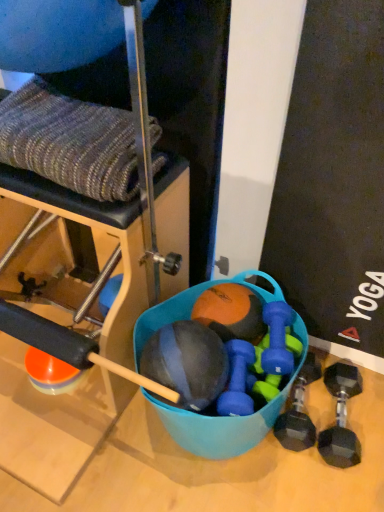
You are a GUI agent. You are given a task and a screenshot of the screen. Output one action in this format:
    pyautogui.click(x=<x>, y=<y>)
    Task: Click on the blue rubber dumbbell at center, marked as the 3th dumbbell in a right-to-left arrangement
    The width and height of the screenshot is (384, 512).
    Given the screenshot: What is the action you would take?
    coord(277,339)

I want to click on knitted fabric at upper left, so click(x=145, y=155).

I want to click on matte black dumbbell at lower right, which is the third dumbbell in left-to-right order, so click(x=298, y=411).

Measure the distance between point (x=233, y=369) and camera.

The depth of point (x=233, y=369) is 3.29 feet.

Locate an element on the screen. black rubber dumbbell at lower right, the 1th dumbbell positioned from the right is located at coordinates (341, 417).

This screenshot has width=384, height=512. Identify the location of bowl on the right of the blue rubber dumbbell at center, the first dumbbell from the left. (226, 419).

Is blue rubber dumbbell at center, the fourth dumbbell positioned from the right, oriented towards blue rubber bucket at center?

Yes, blue rubber dumbbell at center, the fourth dumbbell positioned from the right, is aimed at blue rubber bucket at center.

From the image's perspective, would you say blue rubber dumbbell at center, the first dumbbell from the left, is shown under blue rubber bucket at center?

No, from the image's perspective, blue rubber dumbbell at center, the first dumbbell from the left, is not beneath blue rubber bucket at center.

From the picture: Is blue rubber dumbbell at center, the first dumbbell from the left, inside or outside of blue rubber bucket at center?

The correct answer is: inside.

From a real-world perspective, which is physically above, matte black medicine ball at center, placed as the 2th ball when sorted from back to front, or blue rubber dumbbell at center, the fourth dumbbell positioned from the right?

In real-world perspective, matte black medicine ball at center, placed as the 2th ball when sorted from back to front, is above.

Considering the relative sizes of matte black medicine ball at center, placed as the 2th ball when sorted from back to front, and blue rubber dumbbell at center, the first dumbbell from the left, in the image provided, is matte black medicine ball at center, placed as the 2th ball when sorted from back to front, bigger than blue rubber dumbbell at center, the first dumbbell from the left,?

Indeed, matte black medicine ball at center, placed as the 2th ball when sorted from back to front, has a larger size compared to blue rubber dumbbell at center, the first dumbbell from the left.

Which is less distant, (197,343) or (238,377)?

The point (197,343) is closer to the camera.

The height and width of the screenshot is (512, 384). In order to click on the 2nd ball to the left of the blue rubber bucket at center, starting your count from the anchor in this screenshot , I will do `click(187, 362)`.

Does matte black medicine ball at center, the first ball positioned from the front, have a greater width compared to blue rubber bucket at center?

No.

From the image's perspective, who appears lower, matte black medicine ball at center, placed as the 2th ball when sorted from back to front, or blue rubber bucket at center?

blue rubber bucket at center.

Which is in front, matte black medicine ball at center, the first ball positioned from the front, or blue rubber bucket at center?

matte black medicine ball at center, the first ball positioned from the front, is closer to the camera.

Based on their positions, is blue rubber dumbbell at center, the fourth dumbbell positioned from the right, located to the left or right of blue rubber dumbbell at center, marked as the 3th dumbbell in a right-to-left arrangement?

In the image, blue rubber dumbbell at center, the fourth dumbbell positioned from the right, appears on the left side of blue rubber dumbbell at center, marked as the 3th dumbbell in a right-to-left arrangement.

In the image, is blue rubber dumbbell at center, the first dumbbell from the left, positioned in front of or behind blue rubber dumbbell at center, marked as the 3th dumbbell in a right-to-left arrangement?

In the image, blue rubber dumbbell at center, the first dumbbell from the left, appears in front of blue rubber dumbbell at center, marked as the 3th dumbbell in a right-to-left arrangement.

Would you say blue rubber dumbbell at center, the first dumbbell from the left, is inside or outside blue rubber dumbbell at center, which ranks as the second dumbbell in left-to-right order?

blue rubber dumbbell at center, the first dumbbell from the left, lies outside blue rubber dumbbell at center, which ranks as the second dumbbell in left-to-right order.

Identify the location of dumbbell that is the 1st object located behind the blue rubber dumbbell at center, the first dumbbell from the left. (277, 339).

Is black rubber dumbbell at lower right, positioned as the 4th dumbbell in left-to-right order, positioned far away from orange matte ball at center, which is the 2th ball from front to back?

No, black rubber dumbbell at lower right, positioned as the 4th dumbbell in left-to-right order, is not far from orange matte ball at center, which is the 2th ball from front to back.

From the image's perspective, is black rubber dumbbell at lower right, positioned as the 4th dumbbell in left-to-right order, below orange matte ball at center, which is the first ball in back-to-front order?

Yes, from the image's perspective, black rubber dumbbell at lower right, positioned as the 4th dumbbell in left-to-right order, is below orange matte ball at center, which is the first ball in back-to-front order.

Considering the relative sizes of black rubber dumbbell at lower right, positioned as the 4th dumbbell in left-to-right order, and orange matte ball at center, which is the 2th ball from front to back, in the image provided, is black rubber dumbbell at lower right, positioned as the 4th dumbbell in left-to-right order, smaller than orange matte ball at center, which is the 2th ball from front to back,?

Actually, black rubber dumbbell at lower right, positioned as the 4th dumbbell in left-to-right order, might be larger than orange matte ball at center, which is the 2th ball from front to back.

From a real-world perspective, is black rubber dumbbell at lower right, the 1th dumbbell positioned from the right, physically below orange matte ball at center, which is the 2th ball from front to back?

Yes.

From a real-world perspective, which is physically below, knitted fabric at upper left or blue rubber dumbbell at center, which ranks as the second dumbbell in left-to-right order?

In real-world perspective, blue rubber dumbbell at center, which ranks as the second dumbbell in left-to-right order, is lower.

Considering their positions, is knitted fabric at upper left located in front of or behind blue rubber dumbbell at center, which ranks as the second dumbbell in left-to-right order?

In the image, knitted fabric at upper left appears in front of blue rubber dumbbell at center, which ranks as the second dumbbell in left-to-right order.

Who is taller, knitted fabric at upper left or blue rubber dumbbell at center, marked as the 3th dumbbell in a right-to-left arrangement?

knitted fabric at upper left.

Would you say blue rubber dumbbell at center, marked as the 3th dumbbell in a right-to-left arrangement, is inside or outside matte black dumbbell at lower right, which is the third dumbbell in left-to-right order?

blue rubber dumbbell at center, marked as the 3th dumbbell in a right-to-left arrangement, is spatially situated outside matte black dumbbell at lower right, which is the third dumbbell in left-to-right order.

Is blue rubber dumbbell at center, marked as the 3th dumbbell in a right-to-left arrangement, not close to matte black dumbbell at lower right, which is the third dumbbell in left-to-right order?

No, blue rubber dumbbell at center, marked as the 3th dumbbell in a right-to-left arrangement, is not far away from matte black dumbbell at lower right, which is the third dumbbell in left-to-right order.

Is blue rubber dumbbell at center, which ranks as the second dumbbell in left-to-right order, taller or shorter than matte black dumbbell at lower right, which is counted as the 2th dumbbell, starting from the right?

In the image, blue rubber dumbbell at center, which ranks as the second dumbbell in left-to-right order, appears to be shorter than matte black dumbbell at lower right, which is counted as the 2th dumbbell, starting from the right.

You are a GUI agent. You are given a task and a screenshot of the screen. Output one action in this format:
    pyautogui.click(x=<x>, y=<y>)
    Task: Click on the dumbbell that is the 2nd one when counting upward from the matte black dumbbell at lower right, which is the third dumbbell in left-to-right order (from the image's perspective)
    
    Given the screenshot: What is the action you would take?
    pyautogui.click(x=277, y=339)

Identify the location of bowl below the blue rubber dumbbell at center, the fourth dumbbell positioned from the right (from the image's perspective). (226, 419).

I want to click on dumbbell that is the 1st one when counting rightward from the matte black medicine ball at center, placed as the 2th ball when sorted from back to front, so click(237, 380).

Considering their positions, is matte black medicine ball at center, the first ball positioned from the front, positioned closer to blue rubber bucket at center than orange matte ball at center, which is the 2th ball from front to back?

orange matte ball at center, which is the 2th ball from front to back, is positioned closer to the anchor blue rubber bucket at center.

Based on their spatial positions, is matte black medicine ball at center, the first ball positioned from the front, or black rubber dumbbell at lower right, positioned as the 4th dumbbell in left-to-right order, further from orange matte ball at center, which is the 2th ball from front to back?

black rubber dumbbell at lower right, positioned as the 4th dumbbell in left-to-right order, is further to orange matte ball at center, which is the 2th ball from front to back.

Estimate the real-world distances between objects in this image. Which object is further from blue rubber bucket at center, blue rubber dumbbell at center, which ranks as the second dumbbell in left-to-right order, or black rubber dumbbell at lower right, positioned as the 4th dumbbell in left-to-right order?

black rubber dumbbell at lower right, positioned as the 4th dumbbell in left-to-right order, is further to blue rubber bucket at center.

Estimate the real-world distances between objects in this image. Which object is closer to blue rubber dumbbell at center, the fourth dumbbell positioned from the right, blue rubber dumbbell at center, marked as the 3th dumbbell in a right-to-left arrangement, or knitted fabric at upper left?

blue rubber dumbbell at center, marked as the 3th dumbbell in a right-to-left arrangement, lies closer to blue rubber dumbbell at center, the fourth dumbbell positioned from the right, than the other object.

When comparing their distances from blue rubber dumbbell at center, marked as the 3th dumbbell in a right-to-left arrangement, does knitted fabric at upper left or blue rubber bucket at center seem closer?

blue rubber bucket at center.

Estimate the real-world distances between objects in this image. Which object is closer to blue rubber dumbbell at center, marked as the 3th dumbbell in a right-to-left arrangement, black rubber dumbbell at lower right, positioned as the 4th dumbbell in left-to-right order, or blue rubber dumbbell at center, the first dumbbell from the left?

blue rubber dumbbell at center, the first dumbbell from the left, is positioned closer to the anchor blue rubber dumbbell at center, marked as the 3th dumbbell in a right-to-left arrangement.

Based on their spatial positions, is orange matte ball at center, which is the first ball in back-to-front order, or blue rubber dumbbell at center, marked as the 3th dumbbell in a right-to-left arrangement, further from black rubber dumbbell at lower right, the 1th dumbbell positioned from the right?

Based on the image, orange matte ball at center, which is the first ball in back-to-front order, appears to be further to black rubber dumbbell at lower right, the 1th dumbbell positioned from the right.

Estimate the real-world distances between objects in this image. Which object is further from matte black medicine ball at center, placed as the 2th ball when sorted from back to front, blue rubber dumbbell at center, marked as the 3th dumbbell in a right-to-left arrangement, or black rubber dumbbell at lower right, positioned as the 4th dumbbell in left-to-right order?

Among the two, black rubber dumbbell at lower right, positioned as the 4th dumbbell in left-to-right order, is located further to matte black medicine ball at center, placed as the 2th ball when sorted from back to front.

The height and width of the screenshot is (512, 384). Identify the location of bowl between matte black medicine ball at center, placed as the 2th ball when sorted from back to front, and matte black dumbbell at lower right, which is counted as the 2th dumbbell, starting from the right, in the front-back direction. (226, 419).

The height and width of the screenshot is (512, 384). I want to click on ball located between matte black medicine ball at center, placed as the 2th ball when sorted from back to front, and matte black dumbbell at lower right, which is counted as the 2th dumbbell, starting from the right, in the left-right direction, so click(x=231, y=312).

Locate an element on the screen. The width and height of the screenshot is (384, 512). bowl situated between matte black medicine ball at center, the first ball positioned from the front, and black rubber dumbbell at lower right, positioned as the 4th dumbbell in left-to-right order, from left to right is located at coordinates click(x=226, y=419).

Where is `ball between knitted fabric at upper left and matte black medicine ball at center, the first ball positioned from the front, in the up-down direction`? This screenshot has height=512, width=384. ball between knitted fabric at upper left and matte black medicine ball at center, the first ball positioned from the front, in the up-down direction is located at coordinates (231, 312).